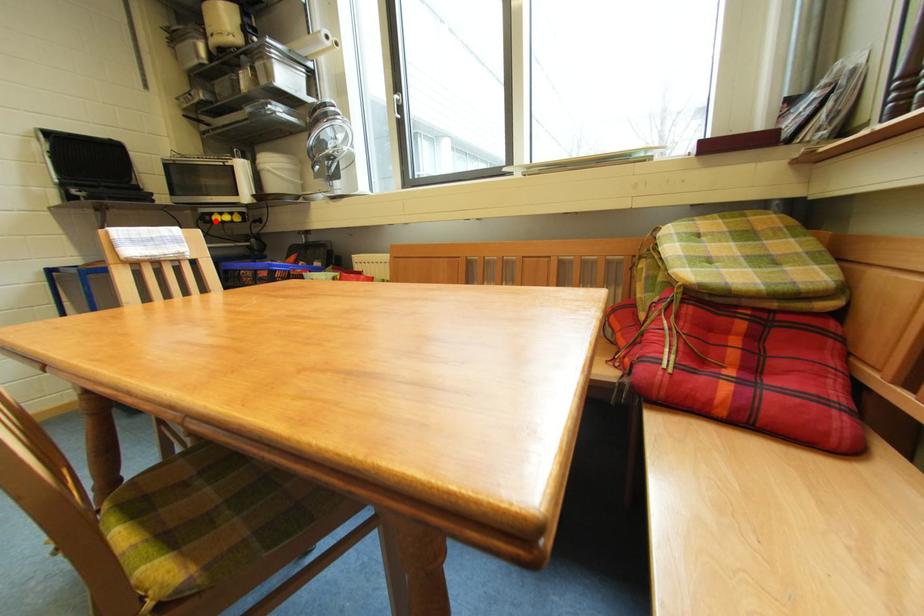
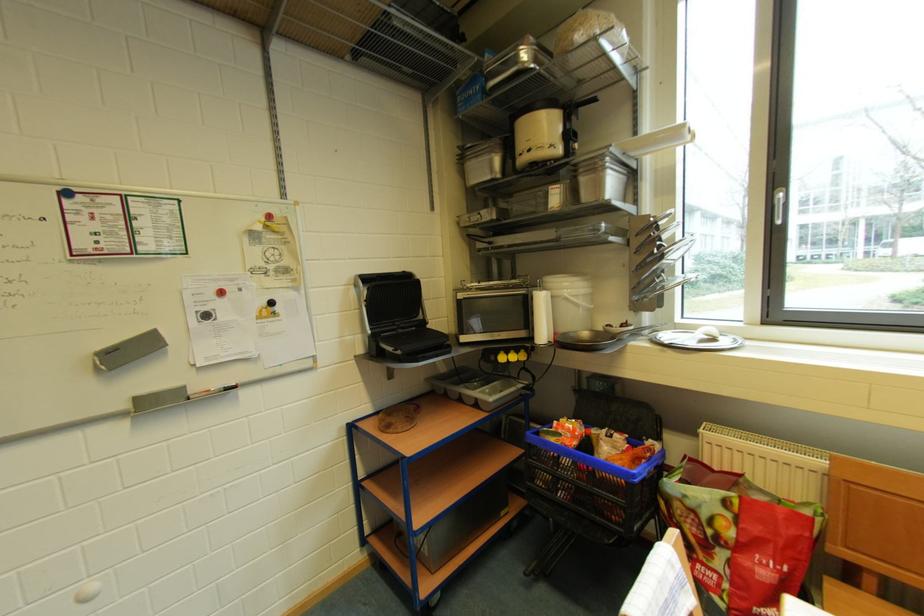
Locate, in the second image, the point that corresponds to the highlighted location in the first image.

(500, 361)